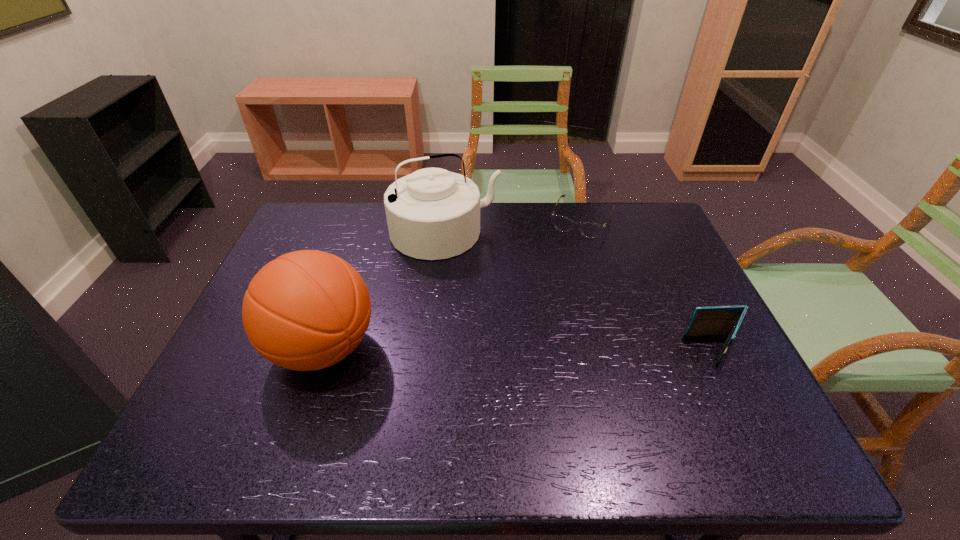
In order to click on basketball in this screenshot , I will do `click(306, 310)`.

I want to click on wallet, so click(718, 320).

Where is `the rightmost object`? The width and height of the screenshot is (960, 540). the rightmost object is located at coordinates (718, 320).

Identify the location of the shortest object. The width and height of the screenshot is (960, 540). (591, 230).

Locate an element on the screen. the third object from left to right is located at coordinates (591, 230).

Locate an element on the screen. This screenshot has width=960, height=540. kettle is located at coordinates (432, 214).

You are a GUI agent. You are given a task and a screenshot of the screen. Output one action in this format:
    pyautogui.click(x=<x>, y=<y>)
    Task: Click on the free region located on the right of the basketball
    
    Given the screenshot: What is the action you would take?
    point(484,348)

The image size is (960, 540). I want to click on vacant space located 0.060m on the exterior surface of the rightmost object, so click(664, 349).

This screenshot has height=540, width=960. I want to click on free location located 0.180m on the exterior surface of the rightmost object, so click(x=613, y=349).

This screenshot has width=960, height=540. Identify the location of free spot located on the exterior surface of the rightmost object. (533, 349).